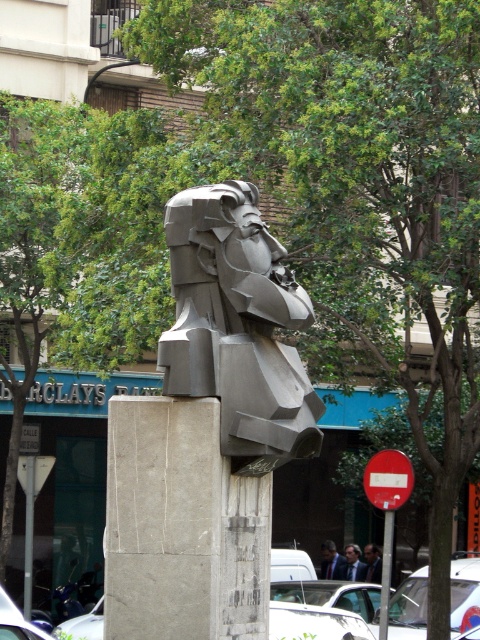
Question: Is gray stone bust at center further to the viewer compared to smooth gray sculpture at center?

Choices:
 (A) yes
 (B) no

Answer: (B)

Question: Is gray stone bust at center behind dark blue suit at lower center?

Choices:
 (A) no
 (B) yes

Answer: (A)

Question: Which of the following is the closest to the observer?

Choices:
 (A) (323, 576)
 (B) (191, 216)
 (C) (370, 580)
 (D) (356, 570)

Answer: (B)

Question: Among these objects, which one is nearest to the camera?

Choices:
 (A) smooth gray sculpture at center
 (B) dark blue suit at center

Answer: (A)

Question: Is gray stone bust at center above smooth gray sculpture at center?

Choices:
 (A) yes
 (B) no

Answer: (A)

Question: Which point is closer to the camera?

Choices:
 (A) (364, 547)
 (B) (252, 289)
 (C) (346, 564)
 (D) (338, 573)

Answer: (B)